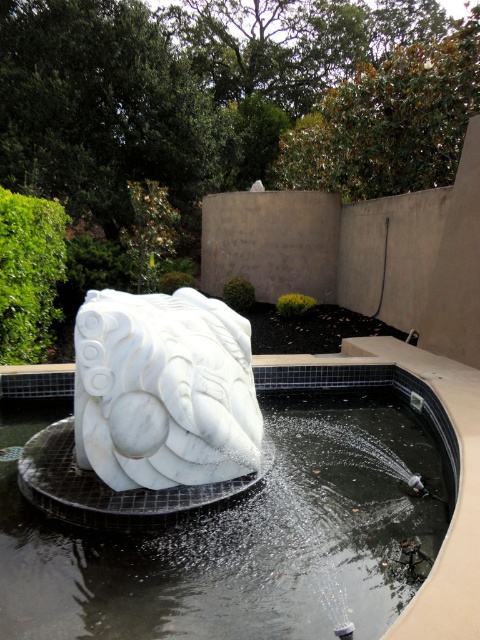
Question: Is white marble fountain at center behind white marble sculpture at center?

Choices:
 (A) yes
 (B) no

Answer: (B)

Question: Can you confirm if white marble fountain at center is positioned to the left of white marble sculpture at center?

Choices:
 (A) no
 (B) yes

Answer: (A)

Question: Which object is farther from the camera taking this photo?

Choices:
 (A) white marble sculpture at center
 (B) white marble fountain at center

Answer: (A)

Question: Which point is closer to the camera?

Choices:
 (A) (144, 609)
 (B) (162, 435)

Answer: (A)

Question: Is white marble fountain at center to the left of white marble sculpture at center from the viewer's perspective?

Choices:
 (A) no
 (B) yes

Answer: (A)